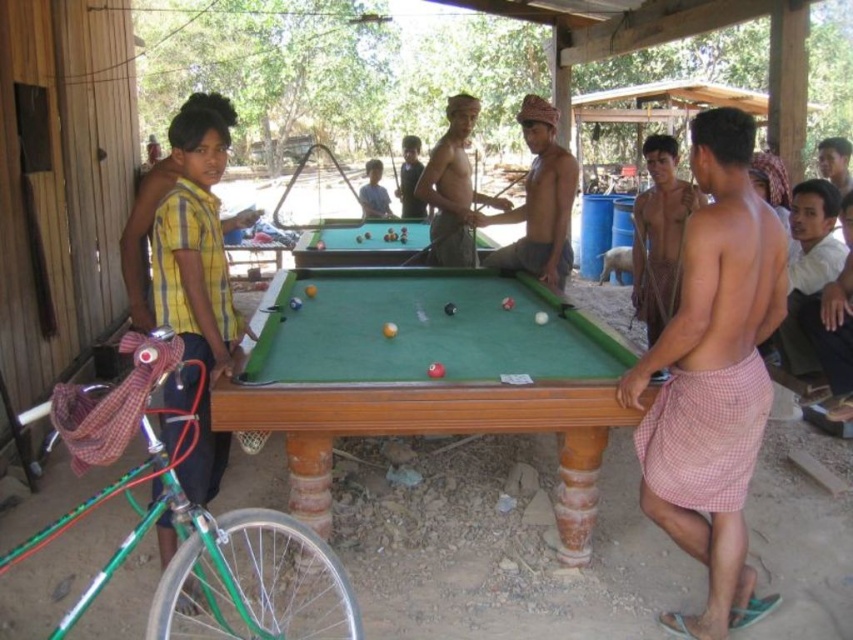
You are standing at the origin point of the coordinate system in the image. The green wooden billiard table at center is at coordinates approximately 0.589 on the x and 0.501 on the y. If you want to walk directly to the table, in which general direction should you move relative to your current position?

Since the green wooden billiard table at center is located at coordinates approximately 0.589 on the x and 0.501 on the y, you should move northeast to reach it from the origin point.

You are organizing a small event at this location and need to place a decorative mat that must be larger than the shiny brown skin at center. Can the brown woven cloth at right be used for this purpose?

The brown woven cloth at right occupies less space than the shiny brown skin at center, so it cannot be used as the decorative mat since it is smaller than required.